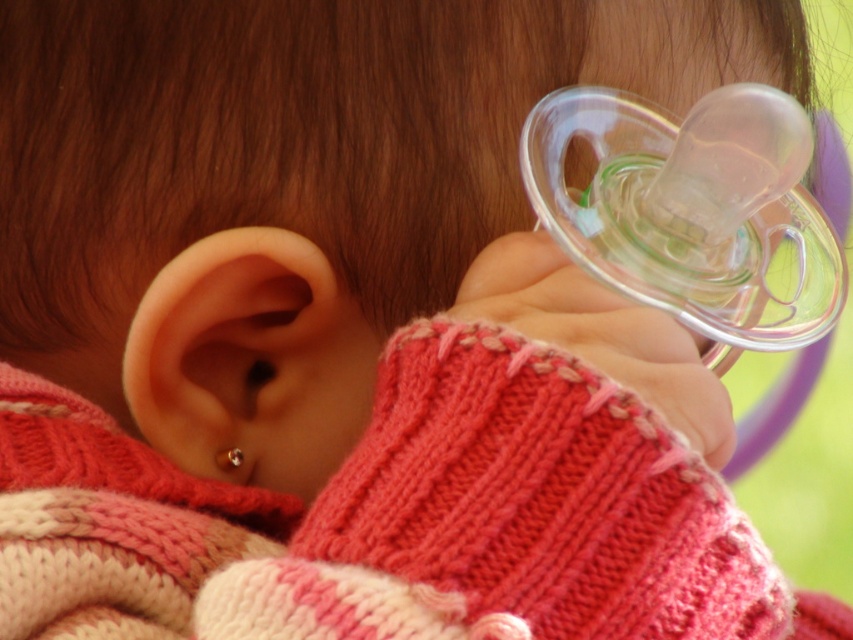
Question: Considering the relative positions of pearl earring at lower left and clear plastic teething ring at ear in the image provided, where is pearl earring at lower left located with respect to clear plastic teething ring at ear?

Choices:
 (A) below
 (B) above

Answer: (B)

Question: Is pearl earring at lower left above clear plastic teething ring at ear?

Choices:
 (A) no
 (B) yes

Answer: (B)

Question: Which object is closer to the camera taking this photo?

Choices:
 (A) clear plastic teething ring at ear
 (B) pearl earring at lower left

Answer: (B)

Question: Is pearl earring at lower left to the left of clear plastic teething ring at ear from the viewer's perspective?

Choices:
 (A) no
 (B) yes

Answer: (A)